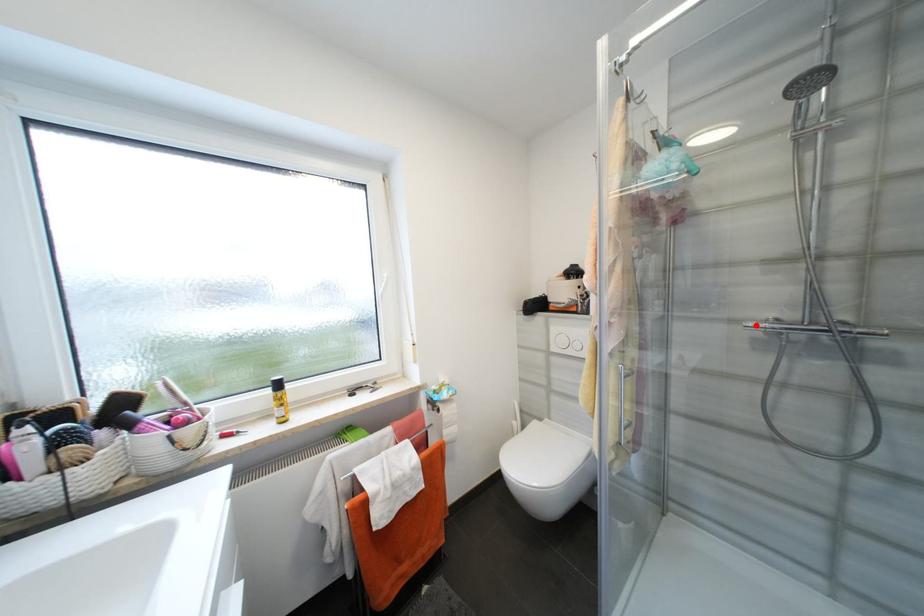
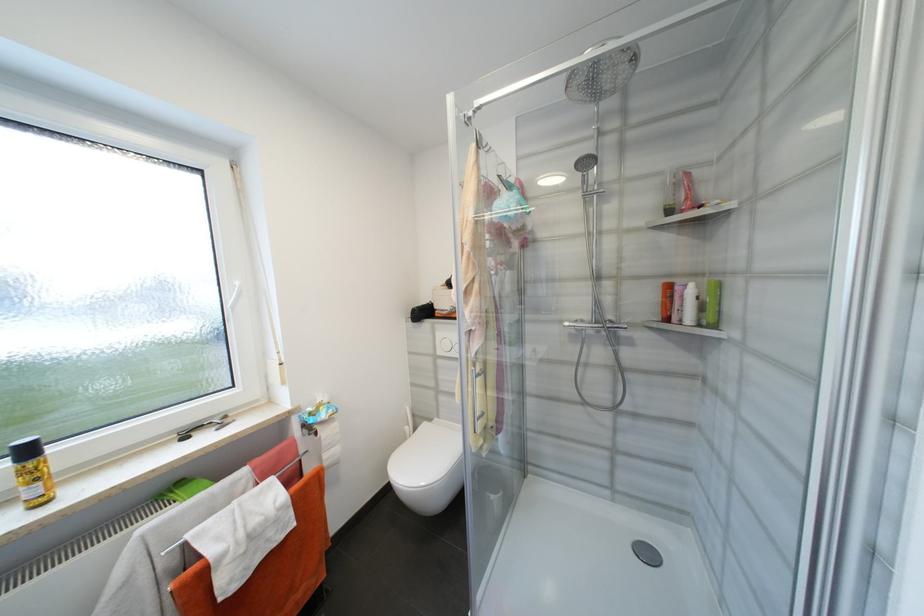
The point at the highlighted location is marked in the first image. Where is the corresponding point in the second image?

(573, 325)